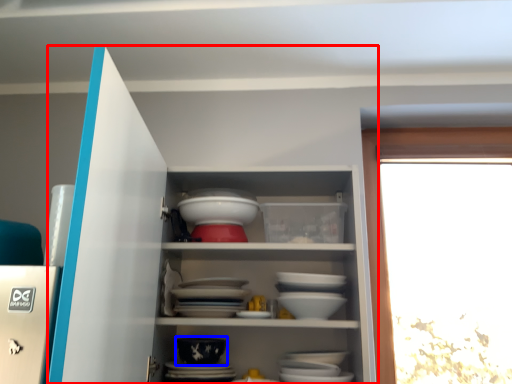
Question: Which point is further to the camera, cupboard (highlighted by a red box) or bowl (highlighted by a blue box)?

Choices:
 (A) cupboard
 (B) bowl

Answer: (B)